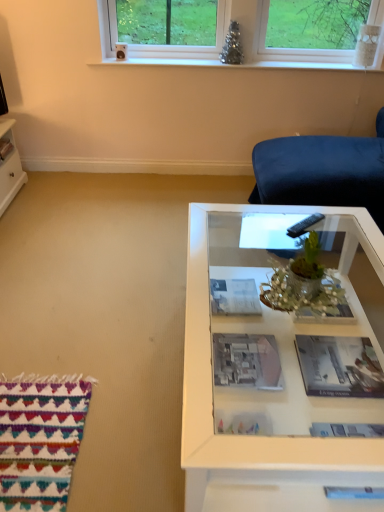
Question: Can you confirm if white glass table at center is taller than black plastic remote at center?

Choices:
 (A) no
 (B) yes

Answer: (B)

Question: From a real-world perspective, is white glass table at center under black plastic remote at center?

Choices:
 (A) no
 (B) yes

Answer: (B)

Question: Can you confirm if white glass table at center is bigger than black plastic remote at center?

Choices:
 (A) yes
 (B) no

Answer: (A)

Question: Is white glass table at center far away from black plastic remote at center?

Choices:
 (A) yes
 (B) no

Answer: (B)

Question: Does white glass table at center have a lesser width compared to black plastic remote at center?

Choices:
 (A) yes
 (B) no

Answer: (B)

Question: In terms of size, does black plastic remote at center appear bigger or smaller than matte gray magazine at lower right, which ranks as the second magazine in back-to-front order?

Choices:
 (A) big
 (B) small

Answer: (B)

Question: Is point (306, 225) positioned closer to the camera than point (317, 362)?

Choices:
 (A) closer
 (B) farther

Answer: (B)

Question: In the image, is black plastic remote at center on the left side or the right side of matte gray magazine at lower right, which ranks as the second magazine in back-to-front order?

Choices:
 (A) right
 (B) left

Answer: (B)

Question: Is black plastic remote at center taller or shorter than matte gray magazine at lower right, marked as the second magazine in a left-to-right arrangement?

Choices:
 (A) short
 (B) tall

Answer: (B)

Question: Based on their sizes in the image, would you say matte gray book at center, which is counted as the 2th book, starting from the back, is bigger or smaller than matte black book at lower left, which ranks as the first book in back-to-front order?

Choices:
 (A) big
 (B) small

Answer: (A)

Question: Which is correct: matte gray book at center, marked as the 1th book in a front-to-back arrangement, is inside matte black book at lower left, the 2th book positioned from the bottom, or outside of it?

Choices:
 (A) inside
 (B) outside

Answer: (B)

Question: From a real-world perspective, is matte gray book at center, marked as the 1th book in a front-to-back arrangement, physically located above or below matte black book at lower left, which is counted as the second book, starting from the right?

Choices:
 (A) above
 (B) below

Answer: (B)

Question: Considering the relative positions of matte gray book at center, positioned as the first book in right-to-left order, and matte black book at lower left, which is counted as the first book, starting from the top, in the image provided, is matte gray book at center, positioned as the first book in right-to-left order, to the left or to the right of matte black book at lower left, which is counted as the first book, starting from the top,?

Choices:
 (A) left
 (B) right

Answer: (B)

Question: Considering the positions of matte paper magazine at center, which ranks as the first magazine in back-to-front order, and clear glass window at upper center in the image, is matte paper magazine at center, which ranks as the first magazine in back-to-front order, wider or thinner than clear glass window at upper center?

Choices:
 (A) wide
 (B) thin

Answer: (A)

Question: In terms of height, does matte paper magazine at center, which is counted as the 2th magazine, starting from the front, look taller or shorter compared to clear glass window at upper center?

Choices:
 (A) short
 (B) tall

Answer: (A)